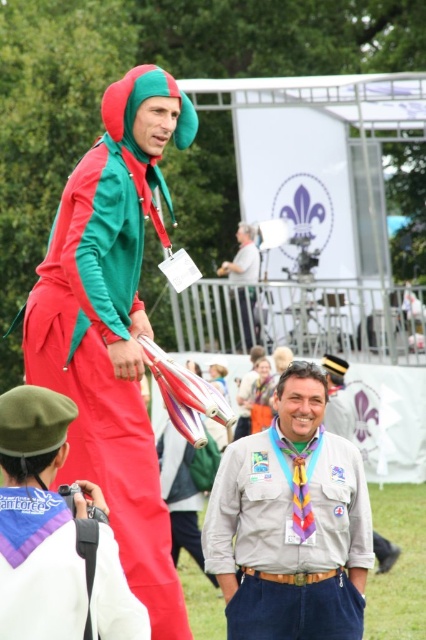
Question: Which is farther from the light gray fabric shirt at upper center?

Choices:
 (A) khaki cotton shirt at center
 (B) matte green and red jumpsuit at center
 (C) matte green and red tracksuit at center

Answer: (B)

Question: Is the position of matte green and red tracksuit at center less distant than that of light gray fabric shirt at upper center?

Choices:
 (A) no
 (B) yes

Answer: (B)

Question: Which point is closer to the camera?

Choices:
 (A) (129, 406)
 (B) (330, 483)

Answer: (A)

Question: Is matte green and red tracksuit at center below matte green and red jumpsuit at center?

Choices:
 (A) yes
 (B) no

Answer: (B)

Question: Is matte green and red tracksuit at center above matte green and red jumpsuit at center?

Choices:
 (A) yes
 (B) no

Answer: (A)

Question: Which point is farther to the camera?

Choices:
 (A) (123, 161)
 (B) (250, 288)
 (C) (305, 538)

Answer: (B)